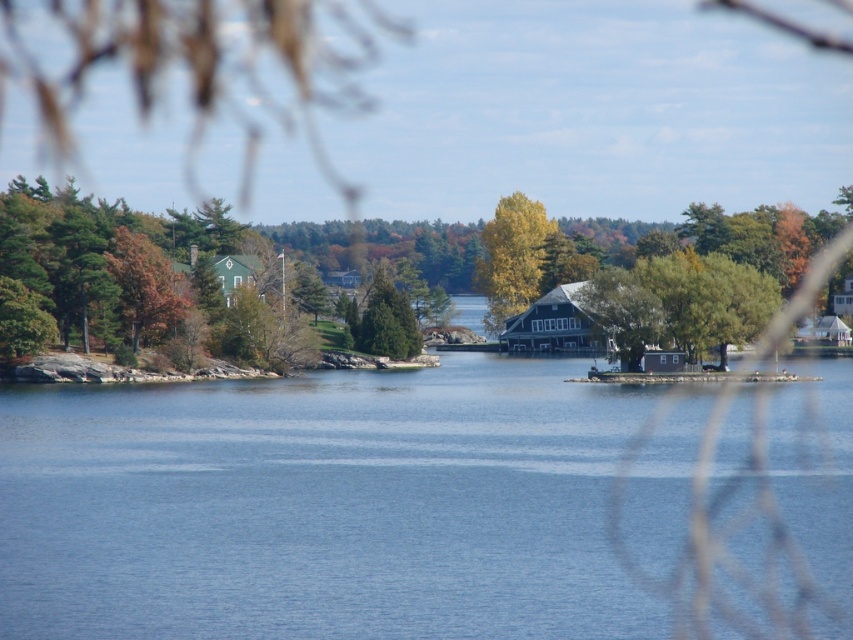
You are standing on the lakeside path and want to take a photo of the blue water at center and the green matte tree at left. Which object should you focus on first to ensure both are in focus?

Since the blue water at center is in front of the green matte tree at left, you should focus on the blue water at center first to ensure both are in focus.

You are a drone operator trying to fly a drone from the green matte tree at left to the blue water at center. The drone has a maximum range of 150 feet. Can the drone safely make this trip without needing to recharge?

The distance between the green matte tree at left and the blue water at center is 144.92 feet, which is within the drone operator drone operator drone operator drone operator drone operator drone operator drone operator drone operator drone operator drone operator drone operator drone operator drone operator drone operator drone operator drone operator drone operator drone operator drone operator drone operator drone operator drone operator drone operator drone operator drone operator drone operator drone o

You are standing at the lakeside and see the blue water at center and the green matte tree at left. Which object is positioned to the right of the other?

The blue water at center is to the right of the green matte tree at left.